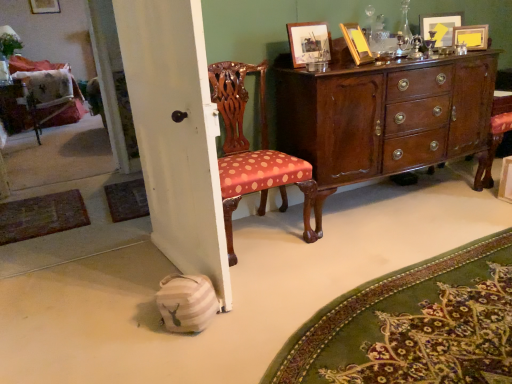
Locate an element on the screen. Image resolution: width=512 pixels, height=384 pixels. free point in front of polished dark wood cabinet at center is located at coordinates (377, 245).